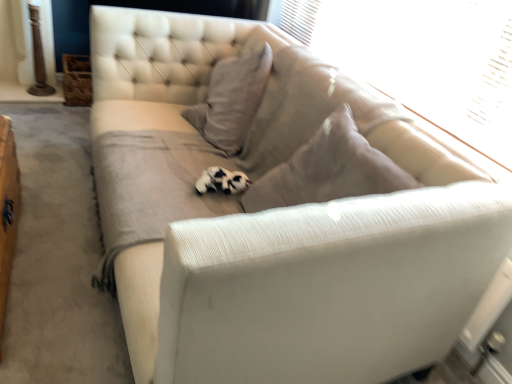
Question: Is transparent plastic window screen at upper right taller or shorter than black and white fur at center?

Choices:
 (A) short
 (B) tall

Answer: (B)

Question: From the image's perspective, is transparent plastic window screen at upper right positioned above or below black and white fur at center?

Choices:
 (A) above
 (B) below

Answer: (A)

Question: In the image, is transparent plastic window screen at upper right positioned in front of or behind black and white fur at center?

Choices:
 (A) behind
 (B) front

Answer: (B)

Question: Is black and white fur at center inside or outside of transparent plastic window screen at upper right?

Choices:
 (A) outside
 (B) inside

Answer: (A)

Question: Considering their positions, is black and white fur at center located in front of or behind transparent plastic window screen at upper right?

Choices:
 (A) front
 (B) behind

Answer: (B)

Question: Considering the positions of black and white fur at center and transparent plastic window screen at upper right in the image, is black and white fur at center bigger or smaller than transparent plastic window screen at upper right?

Choices:
 (A) small
 (B) big

Answer: (A)

Question: In the image, is black and white fur at center on the left side or the right side of transparent plastic window screen at upper right?

Choices:
 (A) left
 (B) right

Answer: (A)